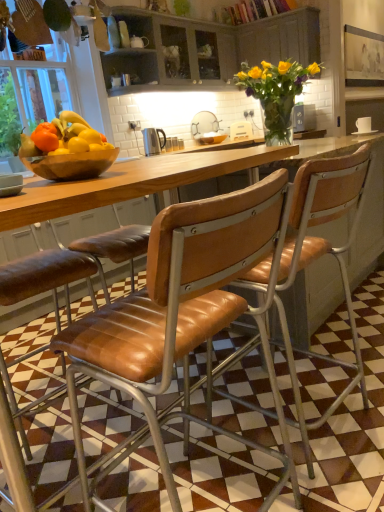
Question: Which direction should I rotate to look at matte brown bowl at center, placed as the 2th bowl when sorted from bottom to top?

Choices:
 (A) left
 (B) right

Answer: (B)

Question: From the image's perspective, is white ceramic sink at center above matte brown bowl at center, placed as the 2th bowl when sorted from bottom to top?

Choices:
 (A) no
 (B) yes

Answer: (B)

Question: From a real-world perspective, is white ceramic sink at center on top of matte brown bowl at center, the second bowl in the left-to-right sequence?

Choices:
 (A) no
 (B) yes

Answer: (B)

Question: From a real-world perspective, is white ceramic sink at center located beneath matte brown bowl at center, marked as the 1th bowl in a right-to-left arrangement?

Choices:
 (A) no
 (B) yes

Answer: (A)

Question: Can you confirm if white ceramic sink at center is smaller than matte brown bowl at center, placed as the 2th bowl when sorted from bottom to top?

Choices:
 (A) yes
 (B) no

Answer: (B)

Question: Can you confirm if white ceramic sink at center is shorter than matte brown bowl at center, marked as the 1th bowl in a right-to-left arrangement?

Choices:
 (A) yes
 (B) no

Answer: (B)

Question: Is white ceramic sink at center positioned before matte brown bowl at center, placed as the 2th bowl when sorted from bottom to top?

Choices:
 (A) yes
 (B) no

Answer: (B)

Question: Is leather seat at center, the 1th chair when ordered from right to left, far from brown leather chair at center, the second chair viewed from the right?

Choices:
 (A) no
 (B) yes

Answer: (A)

Question: Considering the relative sizes of leather seat at center, the 1th chair when ordered from right to left, and brown leather chair at center, the first chair positioned from the left, in the image provided, is leather seat at center, the 1th chair when ordered from right to left, smaller than brown leather chair at center, the first chair positioned from the left,?

Choices:
 (A) no
 (B) yes

Answer: (A)

Question: Can you confirm if leather seat at center, acting as the second chair starting from the left, is wider than brown leather chair at center, the second chair viewed from the right?

Choices:
 (A) no
 (B) yes

Answer: (A)

Question: Is leather seat at center, the 1th chair when ordered from right to left, directly adjacent to brown leather chair at center, the first chair positioned from the left?

Choices:
 (A) yes
 (B) no

Answer: (B)

Question: From the image's perspective, is leather seat at center, the 1th chair when ordered from right to left, on top of brown leather chair at center, the second chair viewed from the right?

Choices:
 (A) yes
 (B) no

Answer: (A)

Question: Is brown leather chair at center, the second chair viewed from the right, a part of leather seat at center, acting as the second chair starting from the left?

Choices:
 (A) yes
 (B) no

Answer: (B)

Question: From a real-world perspective, is matte gray cabinet at upper center, placed as the 2th cabinetry when sorted from right to left, physically below wooden cabinet at upper center, placed as the 2th cabinetry when sorted from left to right?

Choices:
 (A) no
 (B) yes

Answer: (A)